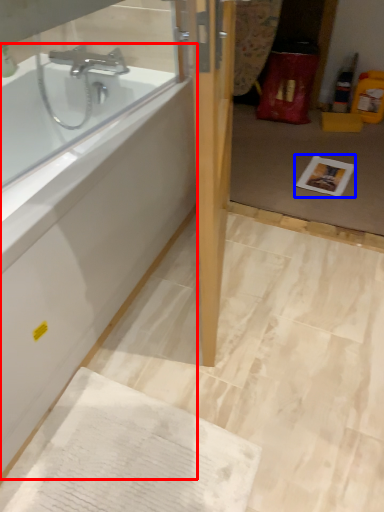
Question: Which object appears farthest to the camera in this image, bathtub (highlighted by a red box) or copy (highlighted by a blue box)?

Choices:
 (A) bathtub
 (B) copy

Answer: (B)